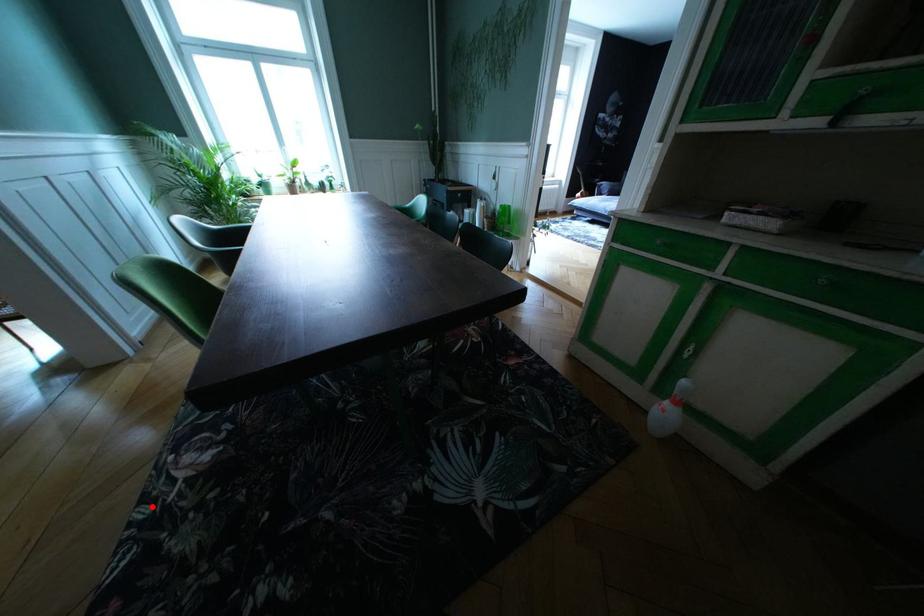
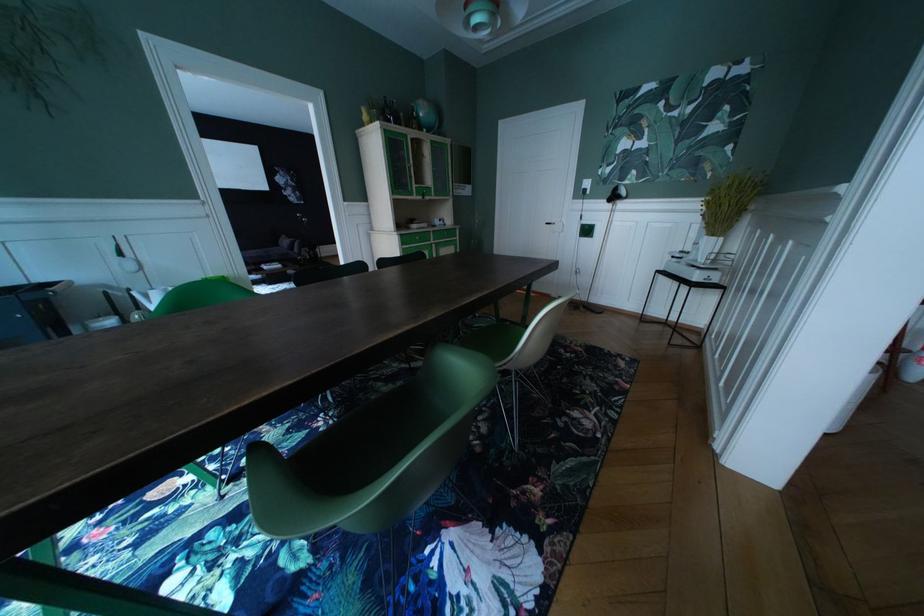
Locate, in the second image, the point that corresponds to the highlighted location in the first image.

(623, 428)